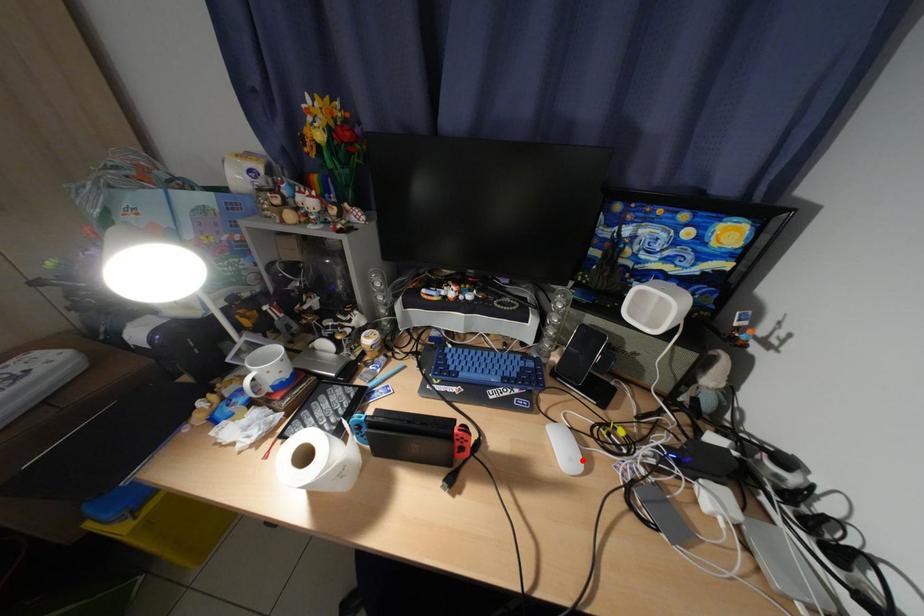
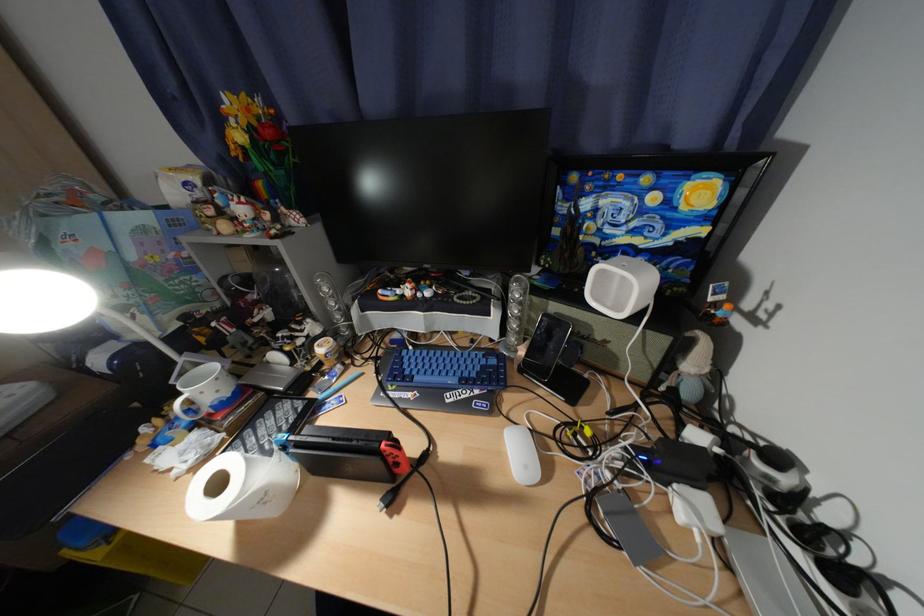
In the second image, find the point that corresponds to the highlighted location in the first image.

(538, 469)